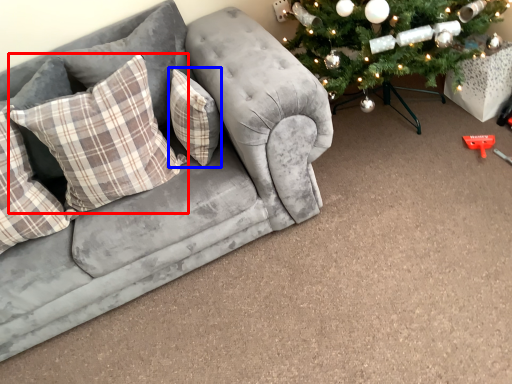
Question: Which object appears closest to the camera in this image, pillow (highlighted by a red box) or pillow (highlighted by a blue box)?

Choices:
 (A) pillow
 (B) pillow

Answer: (A)